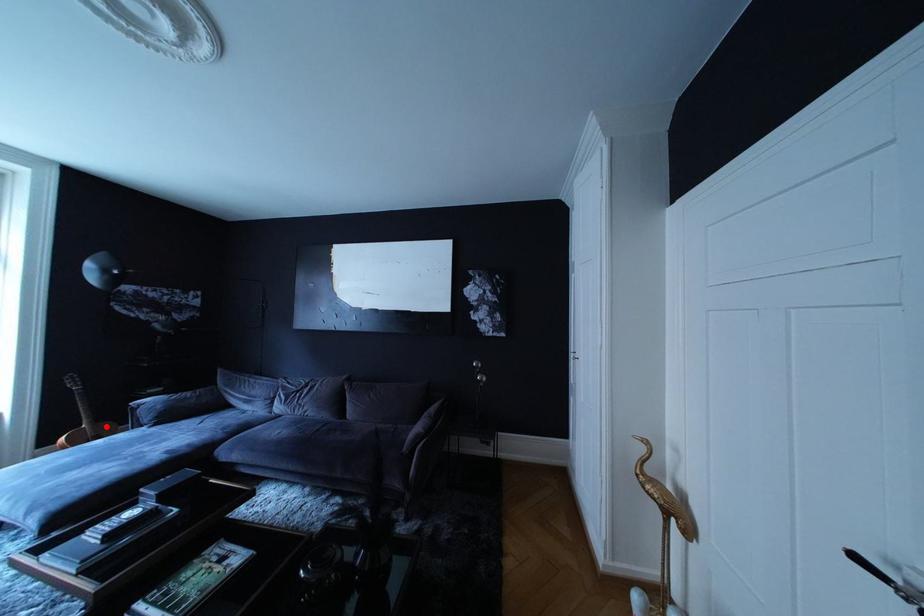
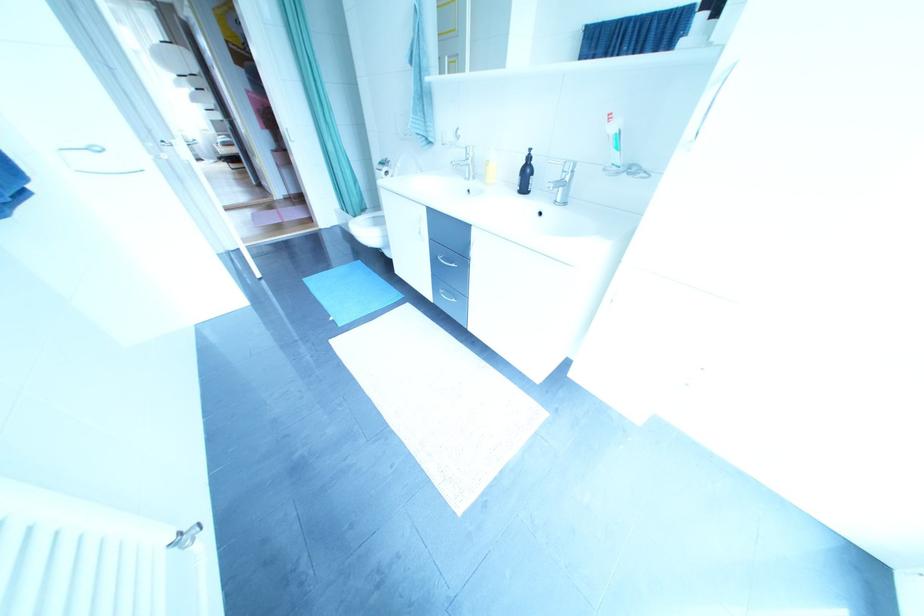
Question: I am providing you with two images of the same scene from different viewpoints. A red point is marked on the first image. Is the red point's position out of view in image 2?

Choices:
 (A) Yes
 (B) No

Answer: (A)